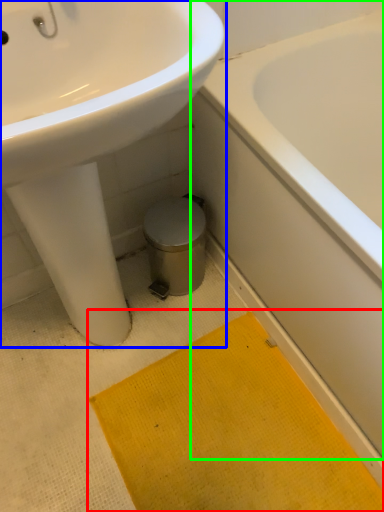
Question: Based on their relative distances, which object is nearer to bath mat (highlighted by a red box)? Choose from sink (highlighted by a blue box) and bathtub (highlighted by a green box).

Choices:
 (A) sink
 (B) bathtub

Answer: (B)